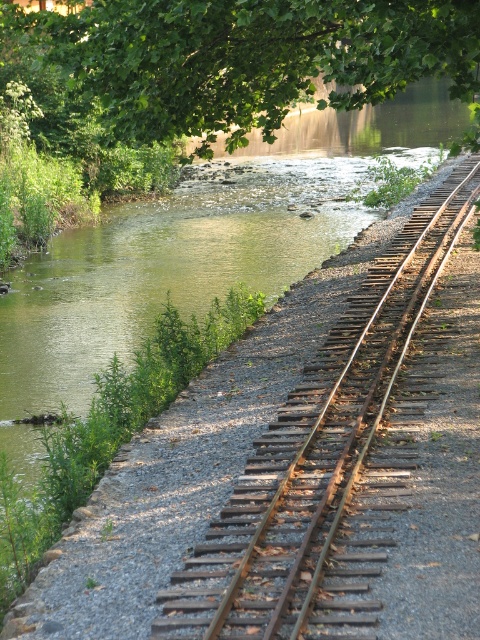
Question: Which point is closer to the camera taking this photo?

Choices:
 (A) (211, 10)
 (B) (312, 445)

Answer: (B)

Question: Does rusty metal train track at right have a larger size compared to green leafy tree at upper center?

Choices:
 (A) yes
 (B) no

Answer: (B)

Question: Which point appears farthest from the camera in this image?

Choices:
 (A) (78, 38)
 (B) (250, 564)

Answer: (A)

Question: Does rusty metal train track at right have a lesser width compared to green leafy tree at upper center?

Choices:
 (A) yes
 (B) no

Answer: (A)

Question: Can you confirm if rusty metal train track at right is smaller than green leafy tree at upper center?

Choices:
 (A) yes
 (B) no

Answer: (A)